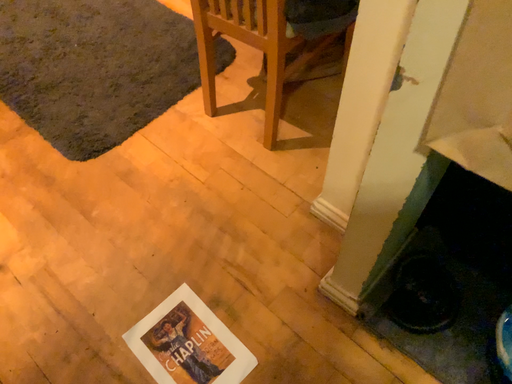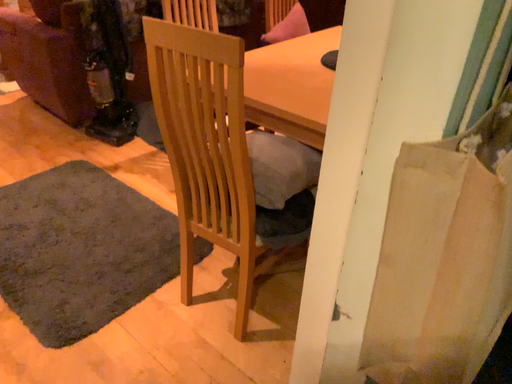
Question: Which way did the camera rotate in the video?

Choices:
 (A) rotated downward
 (B) rotated upward

Answer: (B)